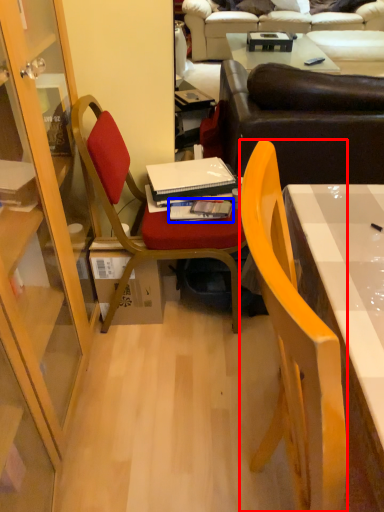
Question: Which object is closer to the camera taking this photo, chair (highlighted by a red box) or book (highlighted by a blue box)?

Choices:
 (A) chair
 (B) book

Answer: (A)